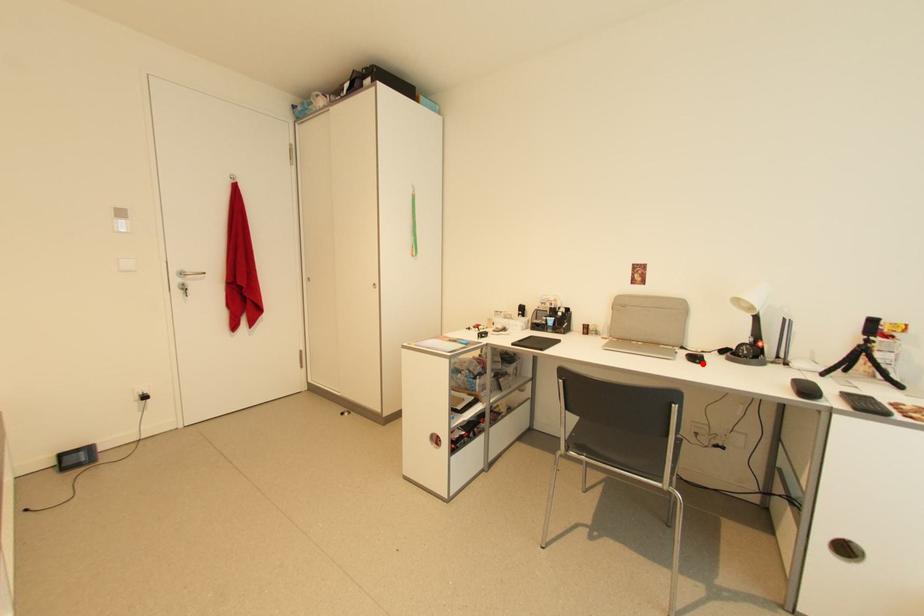
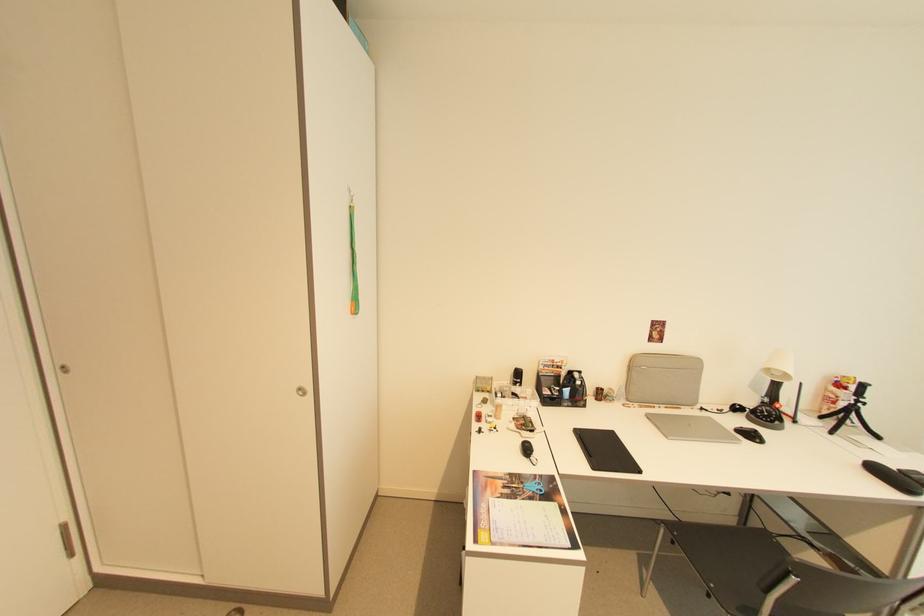
Locate, in the second image, the point that corresponds to the highlighted location in the first image.

(762, 442)